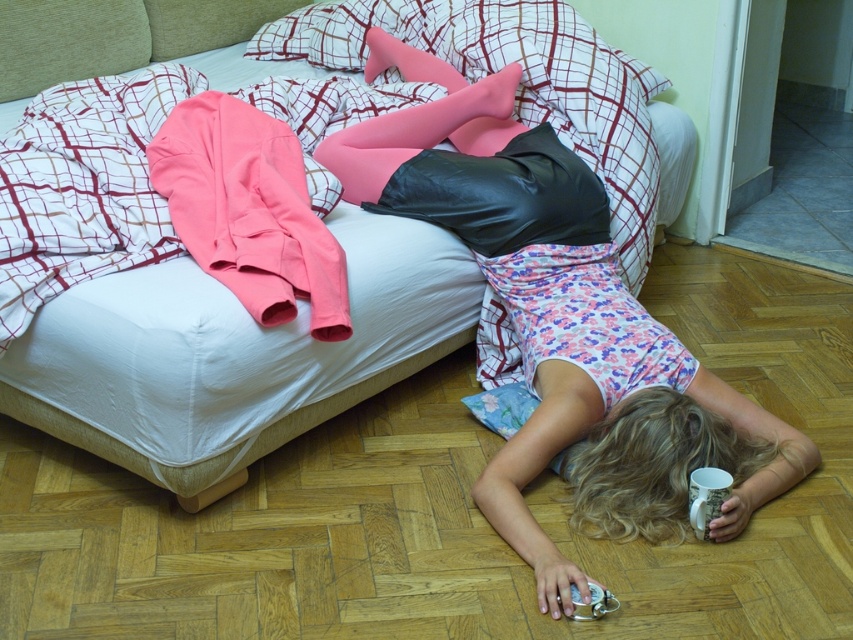
Does floral cotton dress at lower center have a larger size compared to white cotton bed at upper center?

Yes.

Does floral cotton dress at lower center have a greater height compared to white cotton bed at upper center?

Indeed, floral cotton dress at lower center has a greater height compared to white cotton bed at upper center.

Does point (531, 193) come behind point (238, 353)?

Yes, it is behind point (238, 353).

You are a GUI agent. You are given a task and a screenshot of the screen. Output one action in this format:
    pyautogui.click(x=<x>, y=<y>)
    Task: Click on the floral cotton dress at lower center
    Image resolution: width=853 pixels, height=640 pixels.
    Given the screenshot: What is the action you would take?
    pyautogui.click(x=561, y=326)

Looking at this image, is floral cotton dress at lower center to the left of pink fabric jacket at upper left from the viewer's perspective?

In fact, floral cotton dress at lower center is to the right of pink fabric jacket at upper left.

Which is below, floral cotton dress at lower center or pink fabric jacket at upper left?

Positioned lower is floral cotton dress at lower center.

Find the location of a particular element. floral cotton dress at lower center is located at coordinates (561, 326).

Is white cotton bed at upper center below pink fabric jacket at upper left?

Yes, white cotton bed at upper center is below pink fabric jacket at upper left.

Which of these two, white cotton bed at upper center or pink fabric jacket at upper left, stands taller?

With more height is white cotton bed at upper center.

Measure the distance between point (105, 346) and camera.

They are 1.79 meters apart.

Locate an element on the screen. This screenshot has width=853, height=640. white cotton bed at upper center is located at coordinates (190, 404).